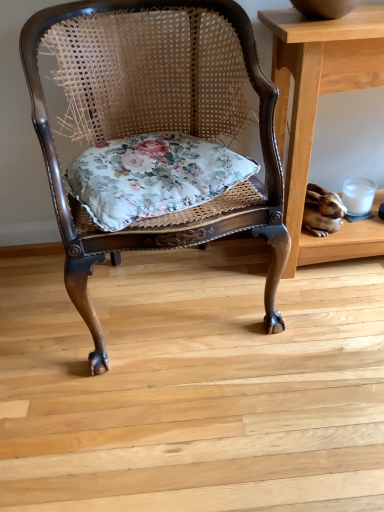
Question: Considering the positions of light brown wooden table at right and floral fabric cushion at center in the image, is light brown wooden table at right taller or shorter than floral fabric cushion at center?

Choices:
 (A) tall
 (B) short

Answer: (A)

Question: Considering the relative positions of light brown wooden table at right and floral fabric cushion at center in the image provided, is light brown wooden table at right to the left or to the right of floral fabric cushion at center?

Choices:
 (A) right
 (B) left

Answer: (A)

Question: Considering the real-world distances, which object is farthest from the floral fabric cushion at center?

Choices:
 (A) light brown wooden table at right
 (B) rattan chair with floral cushion at center

Answer: (A)

Question: Estimate the real-world distances between objects in this image. Which object is closer to the rattan chair with floral cushion at center?

Choices:
 (A) floral fabric cushion at center
 (B) light brown wooden table at right

Answer: (A)